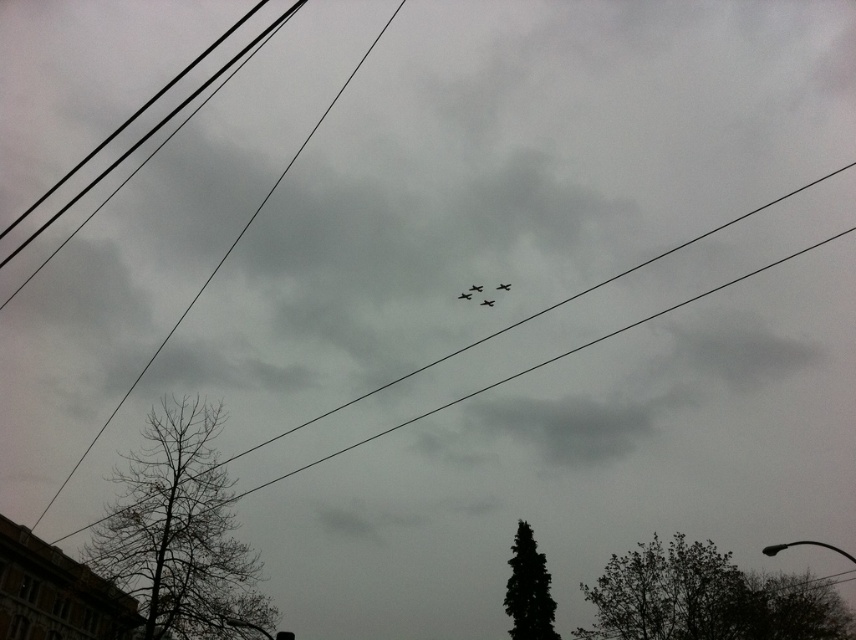
You are a drone operator trying to navigate your drone between the black wire at upper center and the shiny metallic plane at center. Given that your drone is 0.5 meters wide, can it safely pass through the space between them?

The black wire at upper center is bigger than the shiny metallic plane at center, so the space between them might be narrow. However, since the exact distance isn not provided, it is uncertain if the 0.5 meter wide drone can safely pass. More information about the distance between them is needed to determine safety.

You are a pilot flying a small aircraft and notice two objects in your path ahead. The black wire at upper center and the shiny metallic plane at center. Which object is closer to your current position?

The black wire at upper center is closer to the viewer than the shiny metallic plane at center, so the black wire at upper center is closer to your current position.